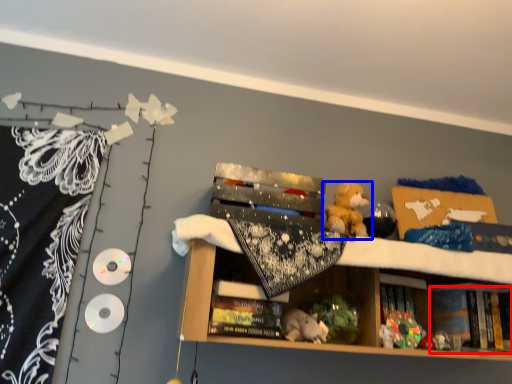
Question: Which object is closer to the camera taking this photo, book (highlighted by a red box) or toy (highlighted by a blue box)?

Choices:
 (A) book
 (B) toy

Answer: (B)